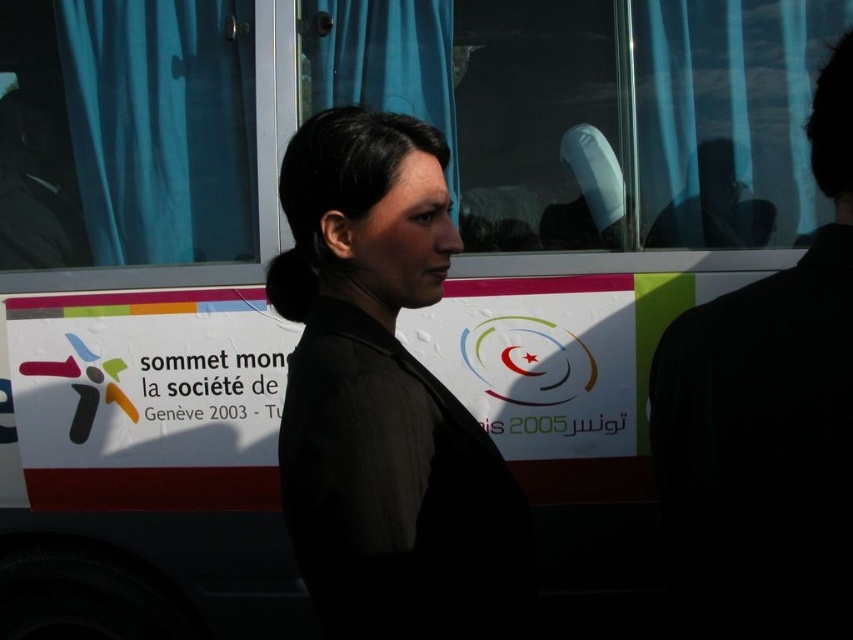
Does black matte jacket at center have a lesser width compared to black fabric coat at right?

In fact, black matte jacket at center might be wider than black fabric coat at right.

Does black matte jacket at center have a greater width compared to black fabric coat at right?

Indeed, black matte jacket at center has a greater width compared to black fabric coat at right.

Does point (328, 419) lie in front of point (769, 324)?

No, it is not.

Find the location of a particular element. The width and height of the screenshot is (853, 640). black matte jacket at center is located at coordinates (386, 401).